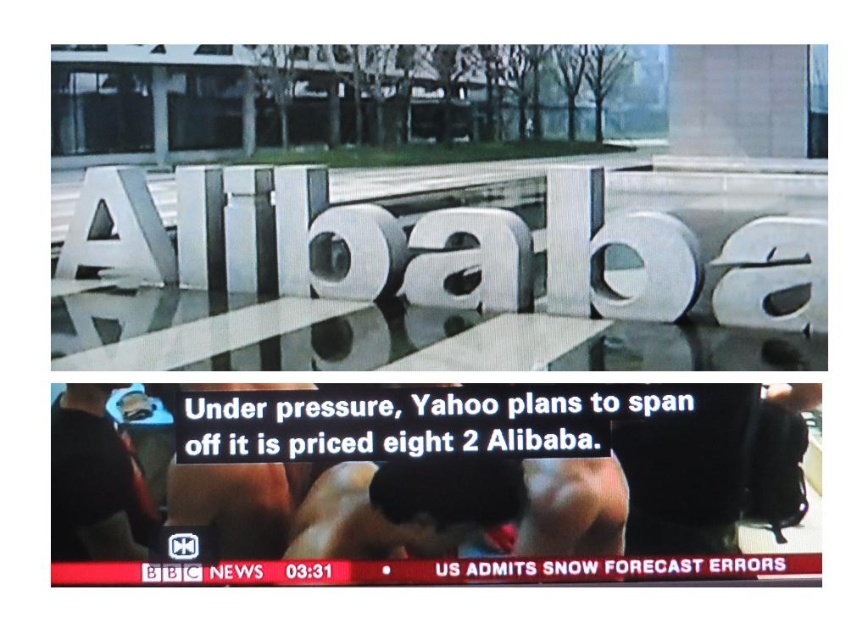
You are a graphic designer reviewing a news broadcast screenshot. You notice two elements on the screen labeled smooth skin squat at center and skinny white skin at center. Which of these elements is taller?

The skinny white skin at center is taller than the smooth skin squat at center.